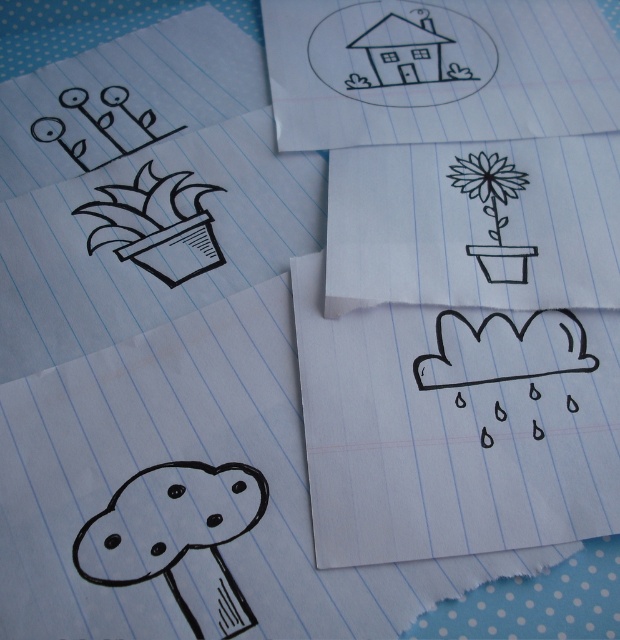
You are an artist trying to fit both the black line drawing house at upper center and the black line drawing flower at center onto a smaller canvas. Which one should you shrink first to ensure both fit?

The black line drawing flower at center should be shrunk first because the black line drawing house at upper center is already larger in width than the black line drawing flower at center.

You are an artist who wants to add a sun to the scene. The sun should be bigger than the black line drawing flower at center but smaller than the black line cloud at center. Is this possible?

The black line cloud at center is larger than the black line drawing flower at center, so yes, you can add a sun that is bigger than the flower but smaller than the cloud.

You are looking at the arrangement of the plants in the top left corner of the image. There are two points marked as point (x=600, y=134) and point (x=498, y=189). Which point is closer to you?

Point (x=600, y=134) is further to the camera than point (x=498, y=189), so the point closer to you is point (x=498, y=189).